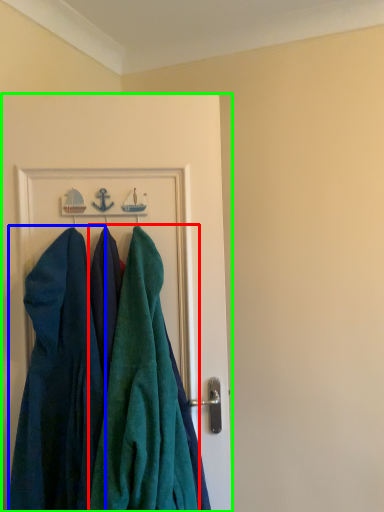
Question: Estimate the real-world distances between objects in this image. Which object is farther from towel (highlighted by a red box), dress (highlighted by a blue box) or door (highlighted by a green box)?

Choices:
 (A) dress
 (B) door

Answer: (B)